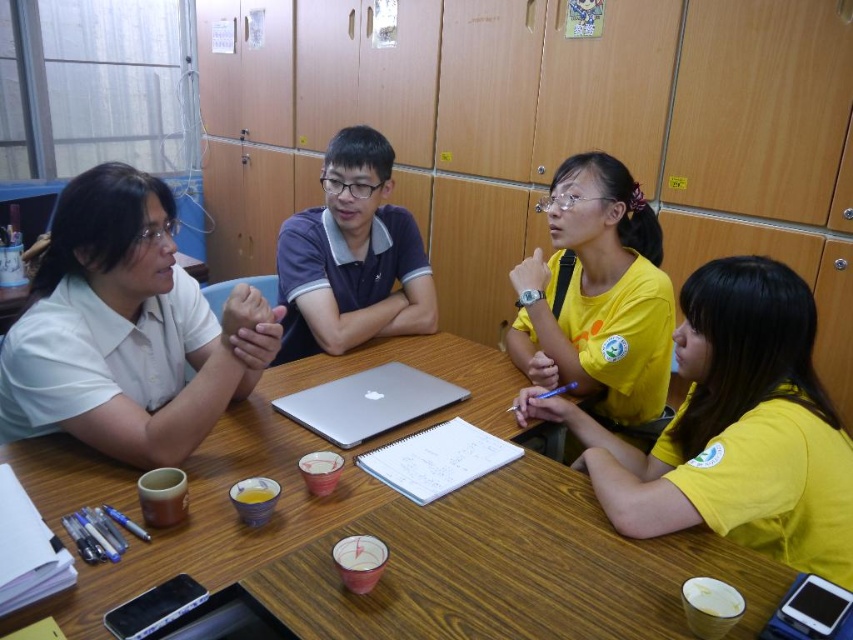
You are standing in front of the table where the group is discussing. There are two points marked on the table surface. The first point is at coordinate [119,356] and the second at [357,234]. Which of these two points is closer to you?

Point [119,356] is closer to the viewer than point [357,234].

You are standing in front of the table and want to hand a document to both the person in the white matte shirt at upper left and the person in the dark blue polo shirt at center. Which person should you approach first based on their proximity to you?

You should approach the white matte shirt at upper left first because they are closer to you than the dark blue polo shirt at center.